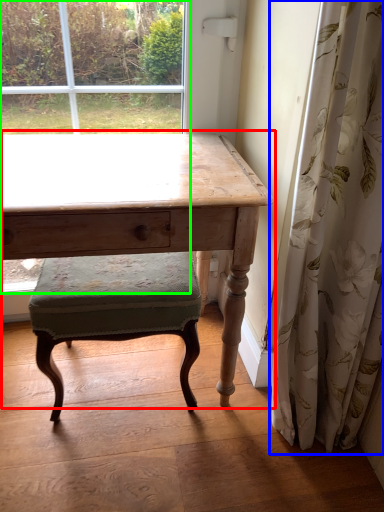
Question: Which object is the closest to the table (highlighted by a red box)? Choose among these: curtain (highlighted by a blue box) or bay window (highlighted by a green box).

Choices:
 (A) curtain
 (B) bay window

Answer: (A)